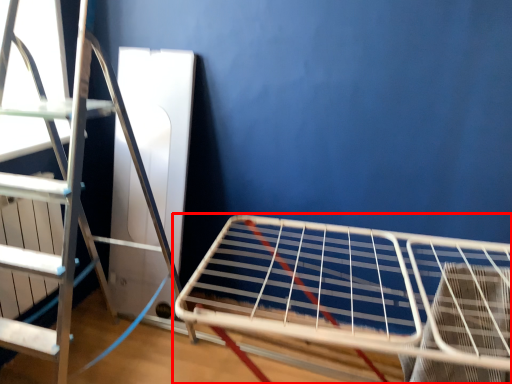
Question: Considering the relative positions of furniture (annotated by the red box) and ladder in the image provided, where is furniture (annotated by the red box) located with respect to the staircase?

Choices:
 (A) left
 (B) right

Answer: (B)